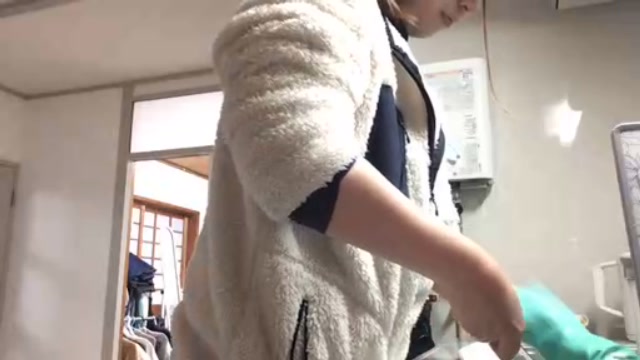
The image size is (640, 360). What are the coordinates of `window` in the screenshot? It's located at (140, 112), (196, 108), (200, 128), (144, 133), (150, 223), (152, 249), (176, 226).